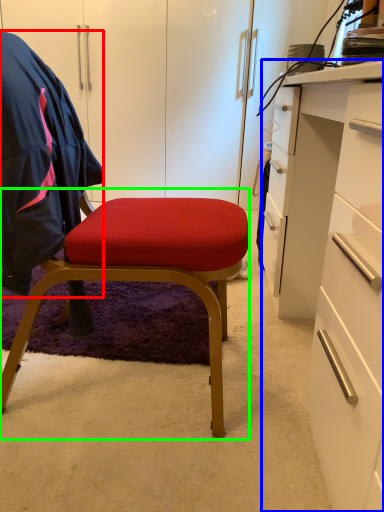
Question: Estimate the real-world distances between objects in this image. Which object is closer to clothing (highlighted by a red box), desk (highlighted by a blue box) or chair (highlighted by a green box)?

Choices:
 (A) desk
 (B) chair

Answer: (B)